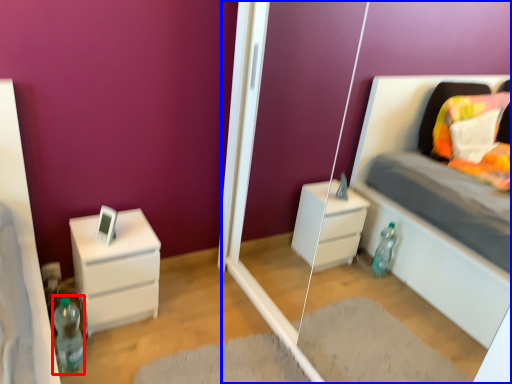
Question: Which object appears farthest to the camera in this image, bottle (highlighted by a red box) or glass door (highlighted by a blue box)?

Choices:
 (A) bottle
 (B) glass door

Answer: (A)